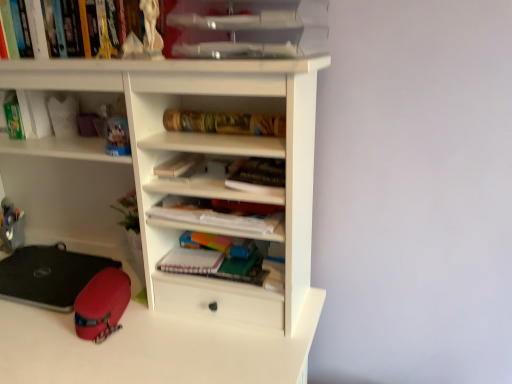
Question: Is white matte notebook at center, which ranks as the second paperback book in top-to-bottom order, inside the boundaries of clear plastic trays at upper center, or outside?

Choices:
 (A) outside
 (B) inside

Answer: (A)

Question: In the image, is white matte notebook at center, which ranks as the 1th paperback book in bottom-to-top order, positioned in front of or behind clear plastic trays at upper center?

Choices:
 (A) behind
 (B) front

Answer: (A)

Question: Based on their relative distances, which object is farther from the rubberized red case at lower left?

Choices:
 (A) hardcover book at upper left, which appears as the 4th book when ordered from the bottom
 (B) rubberized red case at lower left
 (C) hardcover book at center, the 3th book in the top-to-bottom sequence
 (D) white matte paper at center, the 1th paperback book when ordered from top to bottom
 (E) white matte notebook at center, which ranks as the 1th paperback book in bottom-to-top order

Answer: (A)

Question: Which is farther from the gold metallic tube at center, the second book viewed from the top?

Choices:
 (A) rubberized red case at lower left
 (B) rubberized red case at lower left
 (C) clear plastic trays at upper center
 (D) hardcover book at upper left, the 1th book when ordered from top to bottom
 (E) white matte notebook at center, which ranks as the 1th paperback book in bottom-to-top order

Answer: (B)